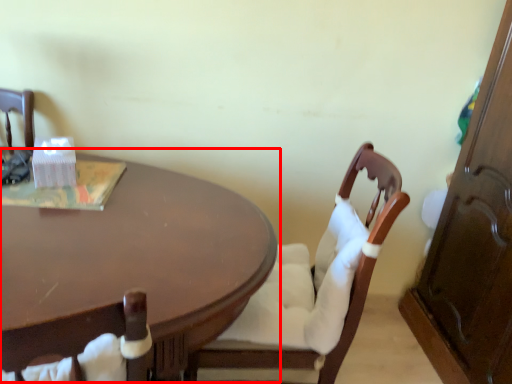
Question: From the image's perspective, considering the relative positions of coffee table (annotated by the red box) and chair in the image provided, where is coffee table (annotated by the red box) located with respect to the staircase?

Choices:
 (A) above
 (B) below

Answer: (B)